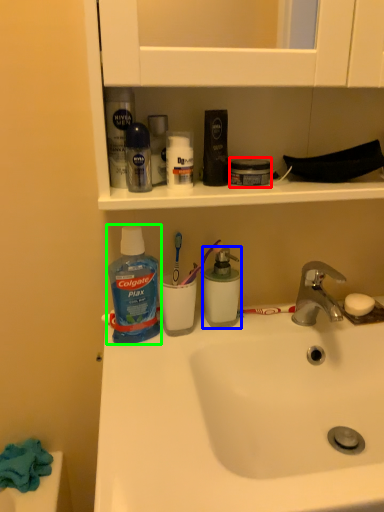
Question: Considering the real-world distances, which object is farthest from mouthwash (highlighted by a red box)? mouthwash (highlighted by a blue box) or cleaning product (highlighted by a green box)?

Choices:
 (A) mouthwash
 (B) cleaning product

Answer: (B)